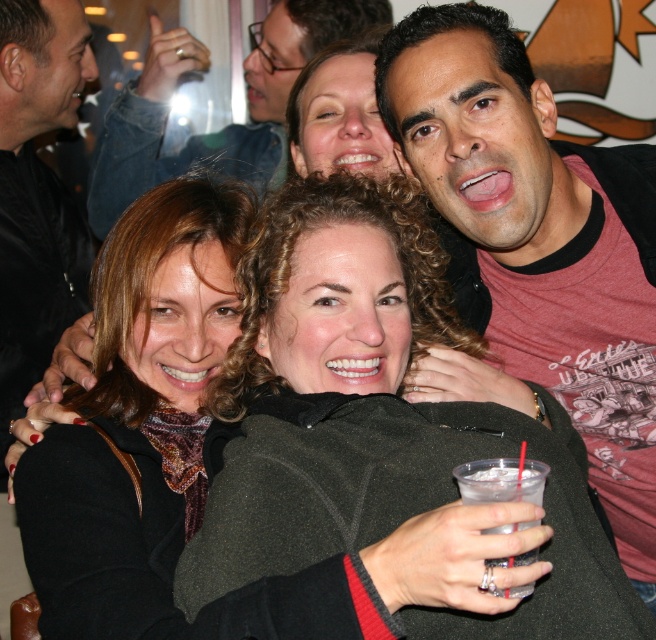
Is matte black jacket at upper center shorter than clear plastic cup at lower center?

Incorrect, matte black jacket at upper center's height does not fall short of clear plastic cup at lower center's.

Is matte black jacket at upper center behind clear plastic cup at lower center?

Yes, matte black jacket at upper center is further from the viewer.

Is point (272, 12) positioned in front of point (502, 595)?

No, it is behind (502, 595).

At what (x,y) coordinates should I click in order to perform the action: click on matte black jacket at upper center. Please return your answer as a coordinate pair (x, y). The width and height of the screenshot is (656, 640). Looking at the image, I should click on (228, 125).

Who is lower down, matte red shirt at upper right or matte black scarf at center?

matte black scarf at center is lower down.

Is matte red shirt at upper right to the right of matte black scarf at center from the viewer's perspective?

Yes, matte red shirt at upper right is to the right of matte black scarf at center.

Who is more distant from viewer, (653, 220) or (87, 612)?

Point (653, 220)

Locate an element on the screen. This screenshot has height=640, width=656. matte red shirt at upper right is located at coordinates point(539,243).

Does point (35, 480) lie behind point (39, 310)?

No, (35, 480) is closer to viewer.

Which of these two, matte black scarf at center or black leather jacket at upper left, stands shorter?

Standing shorter between the two is matte black scarf at center.

Does point (140, 401) come in front of point (56, 196)?

Yes.

The width and height of the screenshot is (656, 640). Find the location of `matte black scarf at center`. matte black scarf at center is located at coordinates (140, 408).